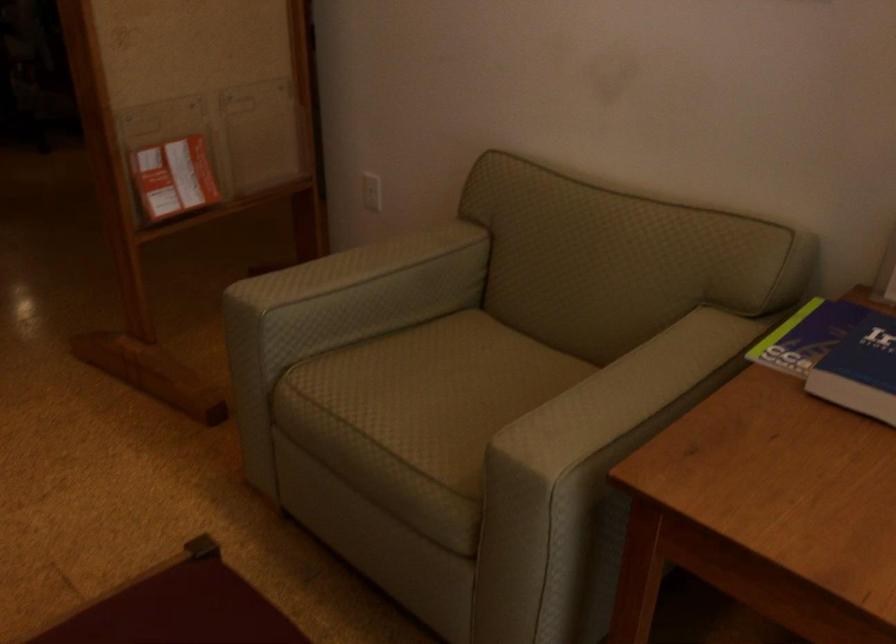
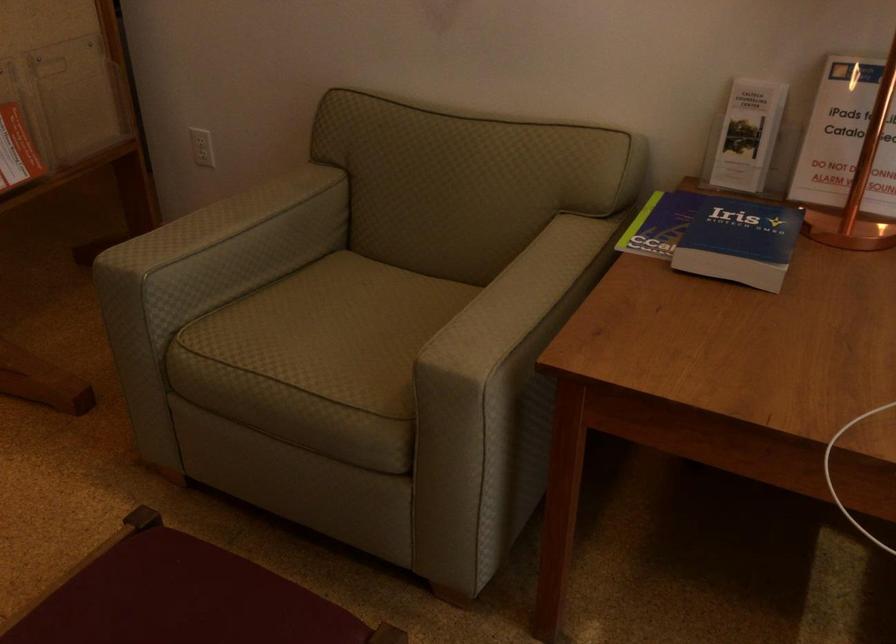
Locate, in the second image, the point that corresponds to [346,269] in the first image.

(219, 222)